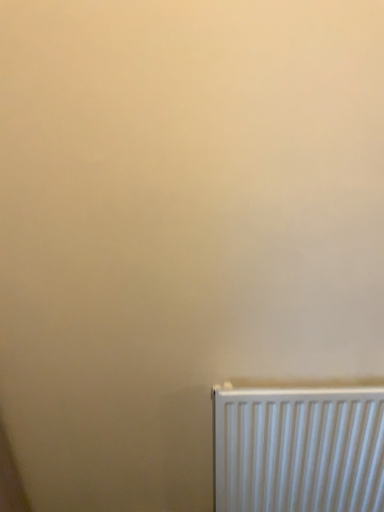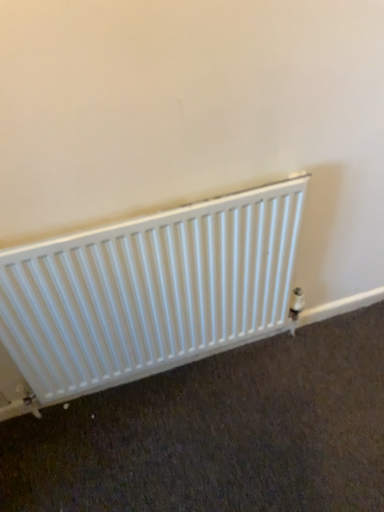
Question: How did the camera likely rotate when shooting the video?

Choices:
 (A) rotated left
 (B) rotated right

Answer: (B)